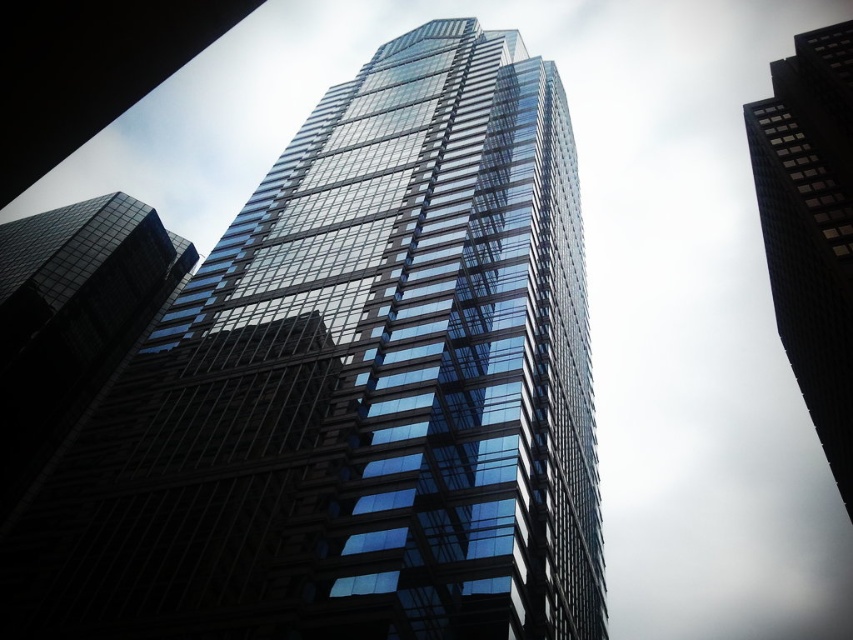
Is point (543, 515) farther from camera compared to point (833, 26)?

No, it is not.

Is transparent glass building at center below black glass skyscraper at upper right?

Actually, transparent glass building at center is above black glass skyscraper at upper right.

This screenshot has width=853, height=640. Describe the element at coordinates (354, 390) in the screenshot. I see `transparent glass building at center` at that location.

This screenshot has height=640, width=853. Find the location of `transparent glass building at center`. transparent glass building at center is located at coordinates (354, 390).